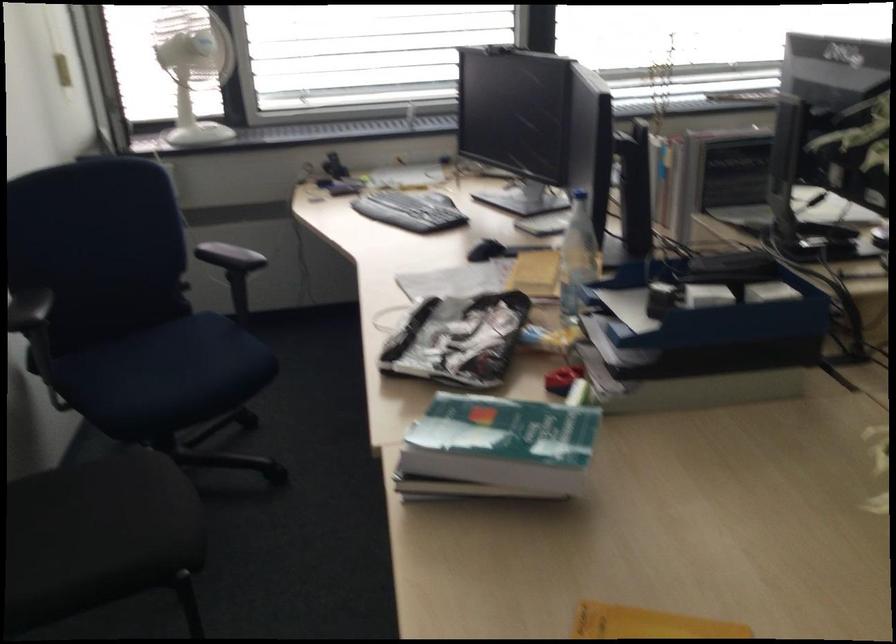
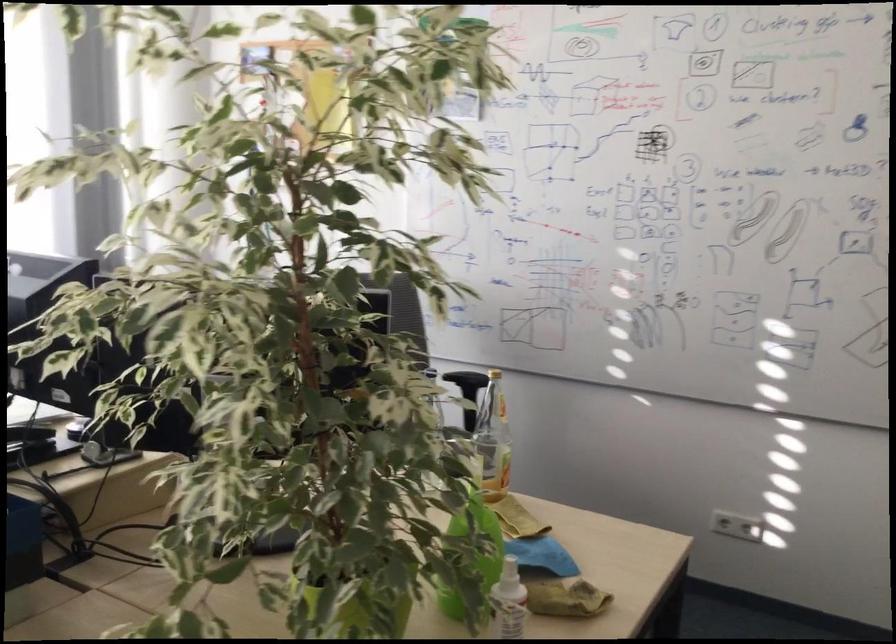
Question: How did the camera likely rotate?

Choices:
 (A) Left
 (B) Right
 (C) Up
 (D) Down

Answer: (B)